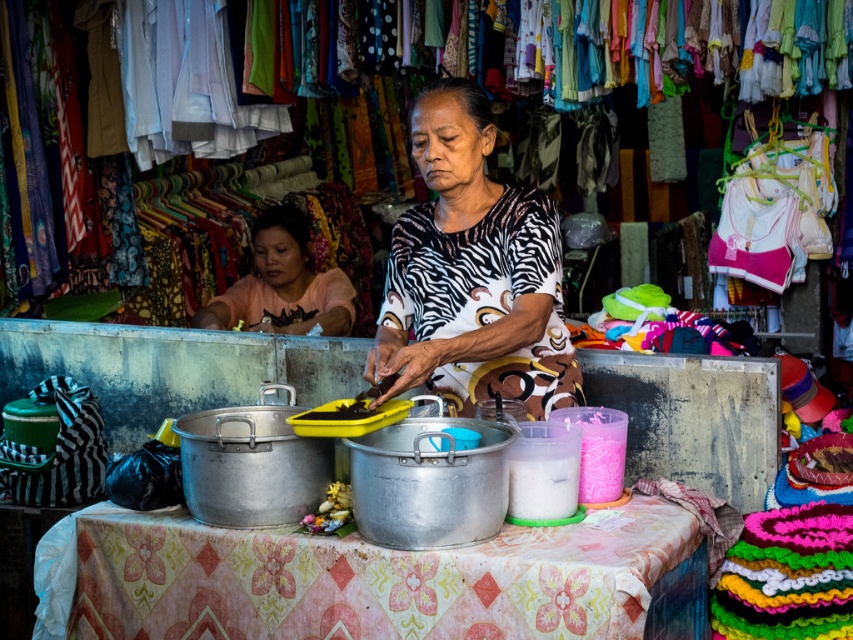
Question: Is printed fabric blouse at center below pink cotton shirt at center?

Choices:
 (A) no
 (B) yes

Answer: (B)

Question: Does floral-patterned fabric at center come behind printed fabric blouse at center?

Choices:
 (A) yes
 (B) no

Answer: (B)

Question: Which object appears closest to the camera in this image?

Choices:
 (A) floral-patterned fabric at center
 (B) printed fabric blouse at center
 (C) black matte food at center
 (D) pink cotton shirt at center

Answer: (A)

Question: Among these points, which one is nearest to the camera?

Choices:
 (A) (341, 406)
 (B) (431, 90)

Answer: (A)

Question: Among these objects, which one is farthest from the camera?

Choices:
 (A) floral-patterned fabric at center
 (B) pink cotton shirt at center

Answer: (B)

Question: Is pink cotton shirt at center to the right of black matte food at center from the viewer's perspective?

Choices:
 (A) no
 (B) yes

Answer: (A)